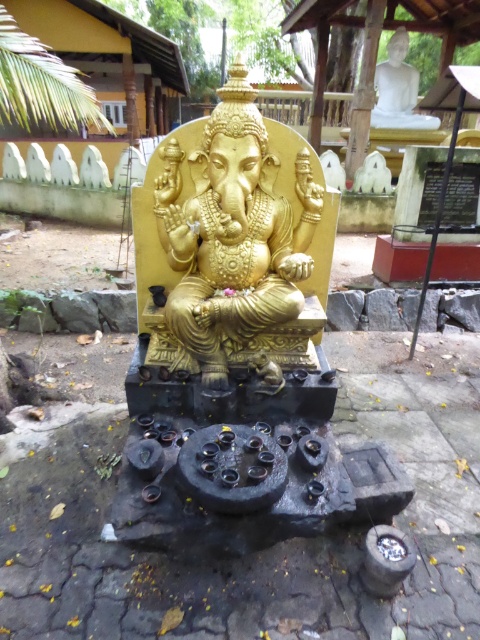
You are a temple visitor who wants to take a photo of both the gold polished statue at center and the white marble statue at upper right in the same frame. Your camera has a maximum zoom range that can capture objects up to 9 meters apart. Can you fit both statues into a single photo without moving your position?

The distance between the gold polished statue at center and the white marble statue at upper right is 9.18 meters. Since your camera can only capture up to 9 meters, you cannot fit both statues into a single photo without moving your position.

You are a visitor at the temple and want to take a photo of both the gold polished statue at center and the white marble statue at upper right. From your current position, which statue should you look towards first to ensure both are in the frame?

You should look towards the gold polished statue at center first because it is located below the white marble statue at upper right, so by centering the lower one, the upper one will naturally be in the frame as well.

You are standing in the temple and want to place a small offering at the base of the gold polished statue at center. Given that the temple floor has a coordinate system where the bottom left corner is the origin, can you determine the exact coordinates where you should place the offering?

The gold polished statue at center is located at point (x=231, y=241), so you should place the offering near those coordinates at the base of the gold polished statue at center.